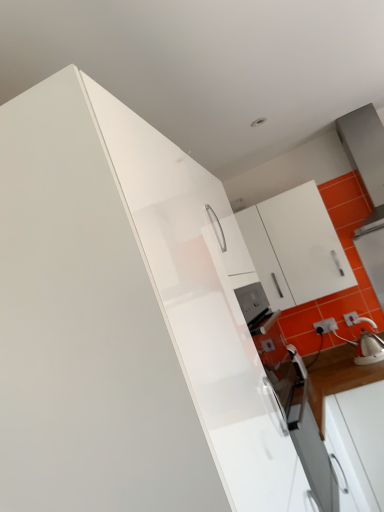
Question: Does white glossy kettle at right have a larger size compared to white plastic electric outlet at lower right?

Choices:
 (A) no
 (B) yes

Answer: (B)

Question: Considering the relative positions of white glossy kettle at right and white plastic electric outlet at lower right in the image provided, is white glossy kettle at right to the right of white plastic electric outlet at lower right from the viewer's perspective?

Choices:
 (A) no
 (B) yes

Answer: (B)

Question: Is white glossy kettle at right closer to camera compared to white plastic electric outlet at lower right?

Choices:
 (A) yes
 (B) no

Answer: (A)

Question: Is white glossy kettle at right positioned behind white plastic electric outlet at lower right?

Choices:
 (A) no
 (B) yes

Answer: (A)

Question: Does white glossy kettle at right have a greater height compared to white plastic electric outlet at lower right?

Choices:
 (A) no
 (B) yes

Answer: (B)

Question: Relative to white glossy cabinet at upper left, the 2th cabinetry positioned from the right, is white glossy cabinet at upper right, the second cabinetry positioned from the left, in front or behind?

Choices:
 (A) front
 (B) behind

Answer: (B)

Question: From the image's perspective, is white glossy cabinet at upper right, the 1th cabinetry positioned from the back, located above or below white glossy cabinet at upper left, the 2th cabinetry positioned from the right?

Choices:
 (A) below
 (B) above

Answer: (B)

Question: Does point (279, 269) appear closer or farther from the camera than point (56, 169)?

Choices:
 (A) farther
 (B) closer

Answer: (A)

Question: Considering the relative positions of white glossy cabinet at upper right, the second cabinetry positioned from the left, and white glossy cabinet at upper left, the 2th cabinetry positioned from the right, in the image provided, is white glossy cabinet at upper right, the second cabinetry positioned from the left, to the left or to the right of white glossy cabinet at upper left, the 2th cabinetry positioned from the right,?

Choices:
 (A) left
 (B) right

Answer: (B)

Question: Based on their sizes in the image, would you say white glossy cabinet at upper left, the 2th cabinetry positioned from the right, is bigger or smaller than white glossy kettle at right?

Choices:
 (A) small
 (B) big

Answer: (B)

Question: From the image's perspective, is white glossy cabinet at upper left, acting as the 1th cabinetry starting from the front, located above or below white glossy kettle at right?

Choices:
 (A) above
 (B) below

Answer: (B)

Question: In terms of height, does white glossy cabinet at upper left, the 2th cabinetry positioned from the right, look taller or shorter compared to white glossy kettle at right?

Choices:
 (A) tall
 (B) short

Answer: (A)

Question: In the image, is white glossy cabinet at upper left, acting as the 1th cabinetry starting from the front, positioned in front of or behind white glossy kettle at right?

Choices:
 (A) front
 (B) behind

Answer: (A)

Question: In the image, is white glossy kettle at right on the left side or the right side of white glossy cabinet at upper left, acting as the 1th cabinetry starting from the front?

Choices:
 (A) left
 (B) right

Answer: (B)

Question: From the image's perspective, is white glossy kettle at right located above or below white glossy cabinet at upper left, which is the second cabinetry in back-to-front order?

Choices:
 (A) above
 (B) below

Answer: (A)